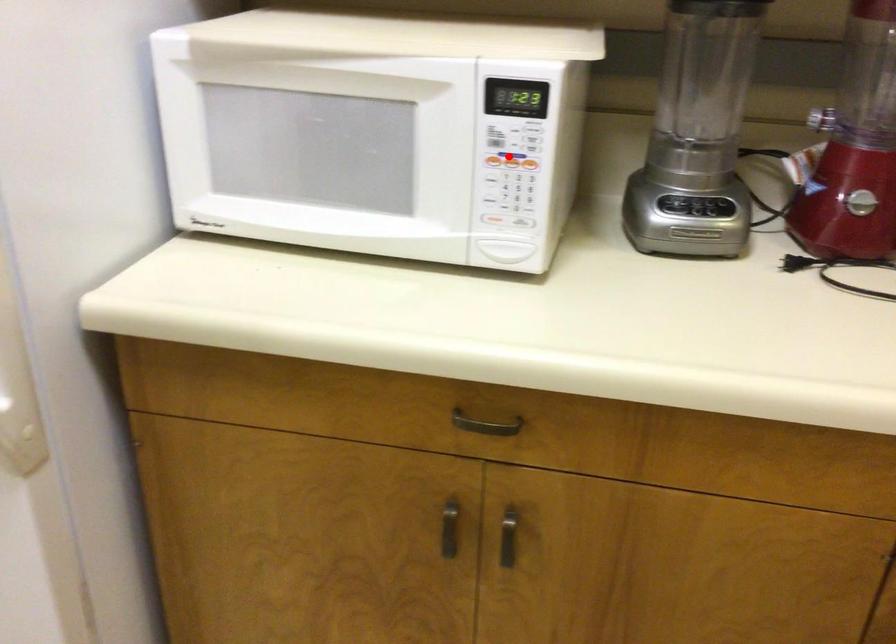
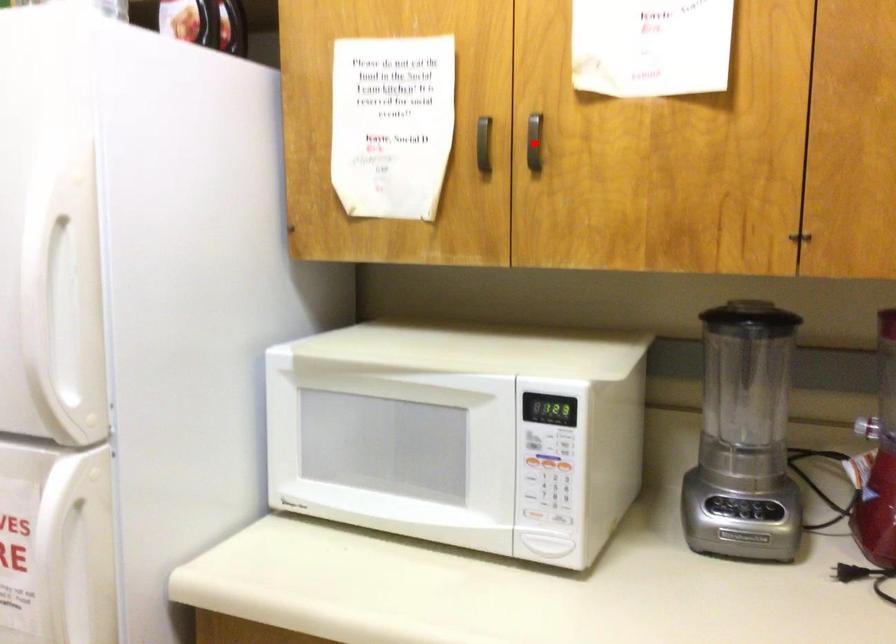
I am providing you with two images of the same scene from different viewpoints. A red point is marked on the first image and another point is marked on the second image. Does the point marked in image1 correspond to the same location as the one in image2?

No